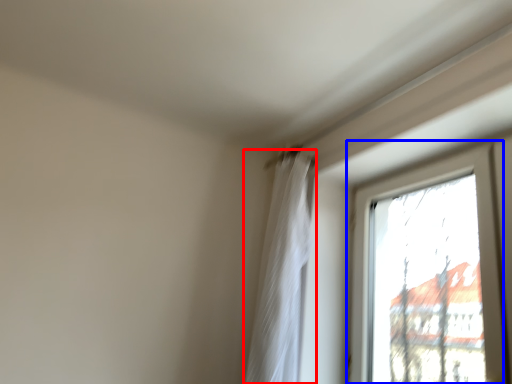
Question: Which object is closer to the camera taking this photo, curtain (highlighted by a red box) or window (highlighted by a blue box)?

Choices:
 (A) curtain
 (B) window

Answer: (B)